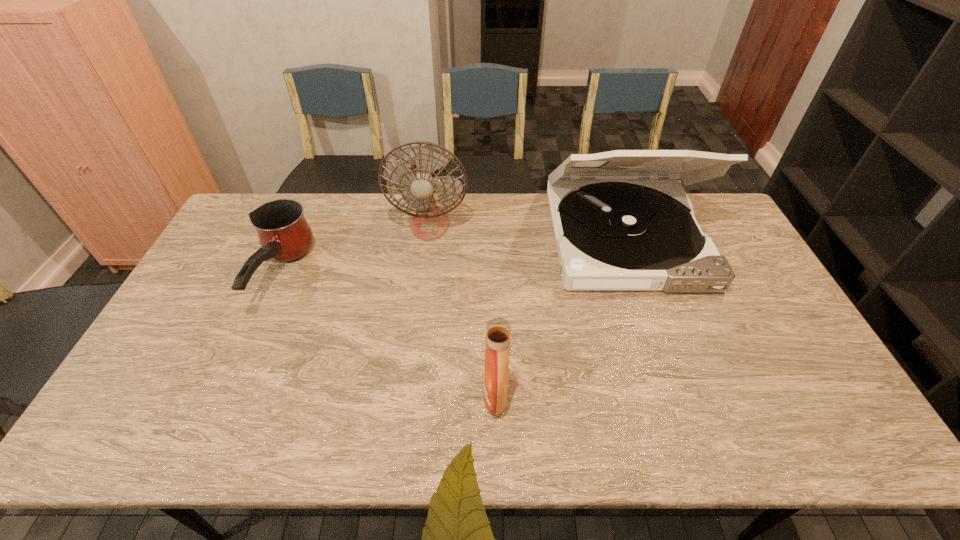
This screenshot has height=540, width=960. What are the coordinates of `vacant region located 0.200m on the front-facing side of the second shortest object` in the screenshot? It's located at (403, 396).

At what (x,y) coordinates should I click in order to perform the action: click on free space located 0.070m on the handle side of the saucepan. Please return your answer as a coordinate pair (x, y). Looking at the image, I should click on (247, 347).

Identify the location of CD player located in the far edge section of the desktop. (615, 229).

Where is `fan located at the far edge`? The image size is (960, 540). fan located at the far edge is located at coordinates pyautogui.click(x=429, y=222).

This screenshot has width=960, height=540. What are the coordinates of `saucepan at the far edge` in the screenshot? It's located at (284, 235).

Locate an element on the screen. The height and width of the screenshot is (540, 960). object that is positioned at the near edge is located at coordinates (498, 330).

Locate an element on the screen. This screenshot has width=960, height=540. object present at the right edge is located at coordinates (615, 229).

The width and height of the screenshot is (960, 540). Find the location of `object situated at the far right corner`. object situated at the far right corner is located at coordinates click(615, 229).

The height and width of the screenshot is (540, 960). Find the location of `vacant area at the far edge of the desktop`. vacant area at the far edge of the desktop is located at coordinates (529, 215).

Image resolution: width=960 pixels, height=540 pixels. I want to click on vacant space at the near edge of the desktop, so click(369, 433).